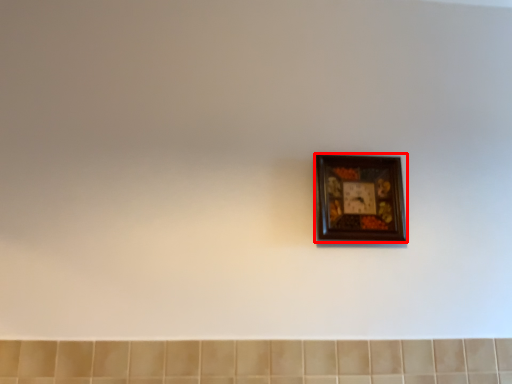
Question: From the image's perspective, considering the relative positions of picture frame (annotated by the red box) and ceramic tile in the image provided, where is picture frame (annotated by the red box) located with respect to the staircase?

Choices:
 (A) above
 (B) below

Answer: (A)